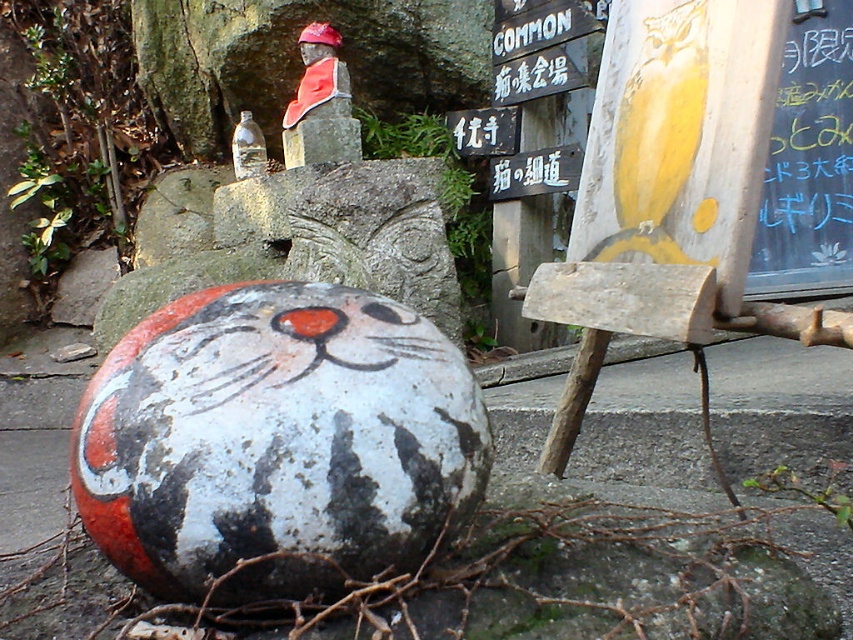
Question: Which point appears closest to the camera in this image?

Choices:
 (A) (572, 77)
 (B) (535, 182)

Answer: (A)

Question: Is wooden signboard at upper center positioned in front of metallic signboard at center?

Choices:
 (A) yes
 (B) no

Answer: (A)

Question: Is painted stone cat at lower left positioned at the back of wooden signboard at upper center?

Choices:
 (A) yes
 (B) no

Answer: (B)

Question: Which point is closer to the camera?

Choices:
 (A) wooden signboard at upper center
 (B) painted stone cat at lower left

Answer: (B)

Question: From the image, what is the correct spatial relationship of painted stone cat at lower left in relation to metallic signboard at center?

Choices:
 (A) below
 (B) above

Answer: (A)

Question: Which point appears farthest from the camera in this image?

Choices:
 (A) (518, 102)
 (B) (193, 477)
 (C) (515, 189)

Answer: (A)